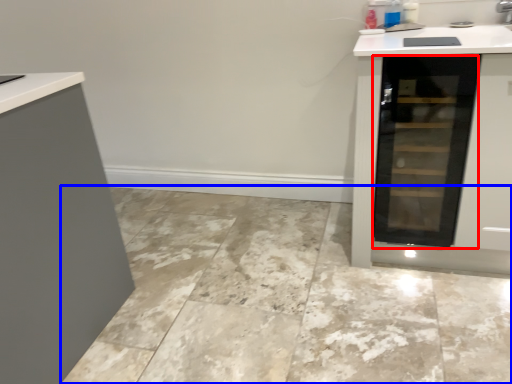
Question: Which of the following is the closest to the observer, glass door (highlighted by a red box) or ceramic tile (highlighted by a blue box)?

Choices:
 (A) glass door
 (B) ceramic tile

Answer: (B)